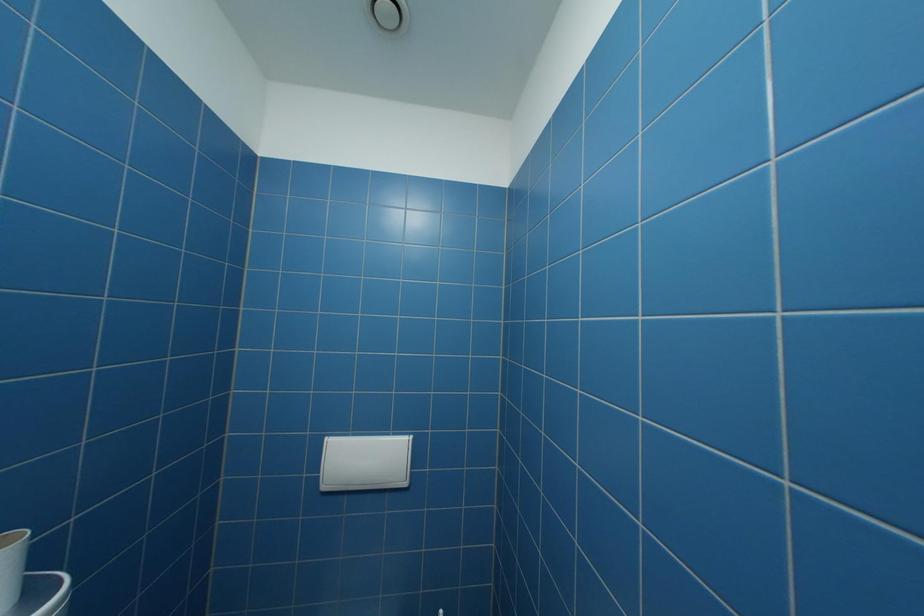
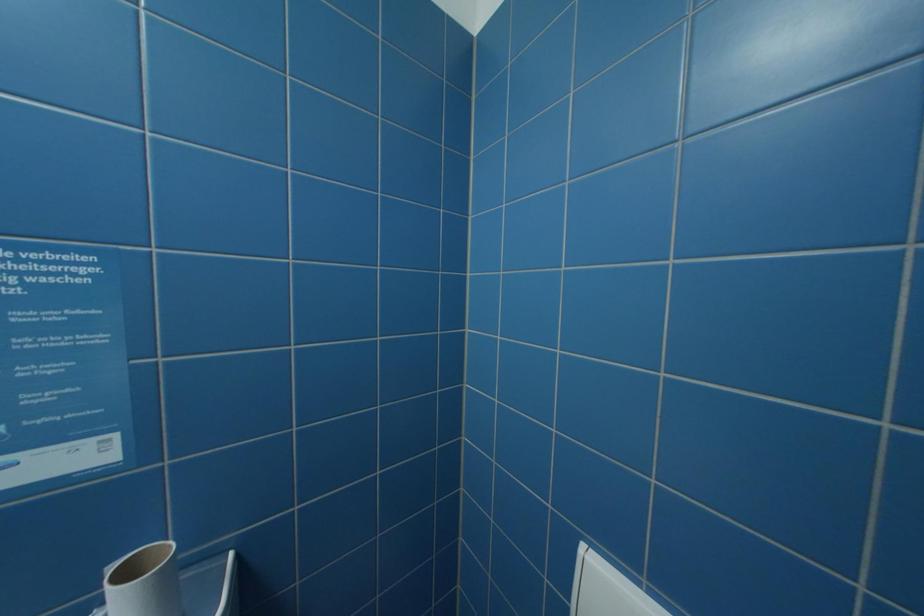
Question: The camera is either moving clockwise (left) or counter-clockwise (right) around the object. The first image is from the beginning of the video and the second image is from the end. Is the camera moving left or right when shooting the video?

Choices:
 (A) Left
 (B) Right

Answer: (B)